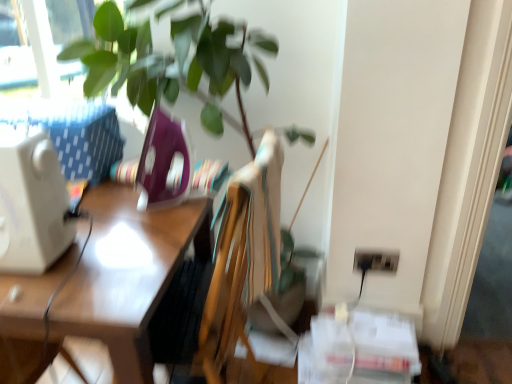
Question: Visually, is wooden desk at left positioned to the left or to the right of black plastic electric outlet at lower right?

Choices:
 (A) right
 (B) left

Answer: (B)

Question: Is point (62, 334) closer or farther from the camera than point (366, 249)?

Choices:
 (A) closer
 (B) farther

Answer: (A)

Question: Which of these objects is positioned closest to the white plastic desktop computer at left?

Choices:
 (A) wooden desk at left
 (B) black plastic electric outlet at lower right

Answer: (A)

Question: Which is farther from the white plastic desktop computer at left?

Choices:
 (A) black plastic electric outlet at lower right
 (B) wooden desk at left

Answer: (A)